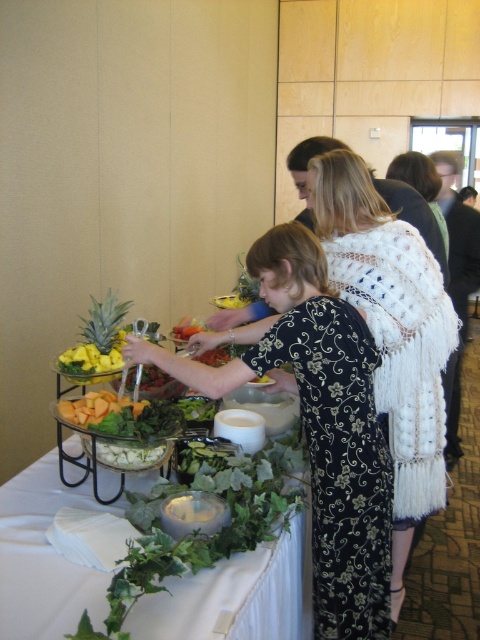
You are a guest at this event and want to grab both the green leafy salad at lower left and the green leafy pineapple at left. If you can only reach 25 inches with your serving utensils, will you be able to comfortably reach both items without moving your position?

The distance between the green leafy salad at lower left and the green leafy pineapple at left is 27.19 inches. Since your utensils can only reach 25 inches, you won not be able to comfortably reach both items without moving your position.